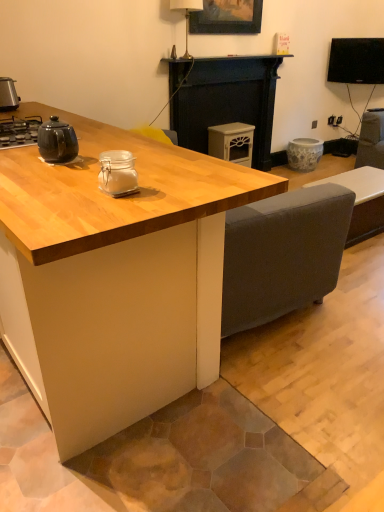
You are a GUI agent. You are given a task and a screenshot of the screen. Output one action in this format:
    pyautogui.click(x=<x>, y=<y>)
    Task: Click on the unoccupied region to the right of clear glass jar at center, which appears as the third appliance when viewed from the right
    The width and height of the screenshot is (384, 512).
    Given the screenshot: What is the action you would take?
    [x=180, y=187]